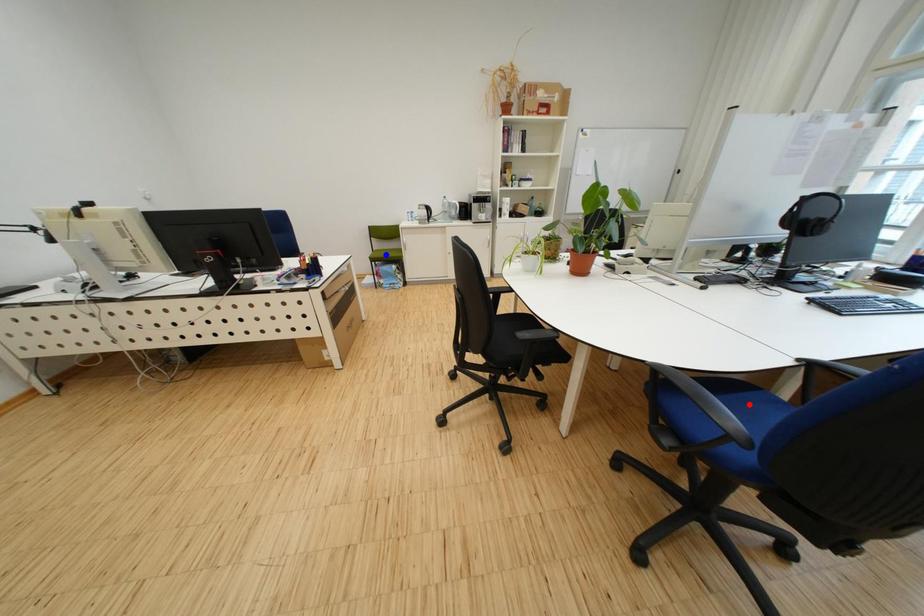
Question: Which of the two points in the image is closer to the camera?

Choices:
 (A) Blue point is closer.
 (B) Red point is closer.

Answer: (B)